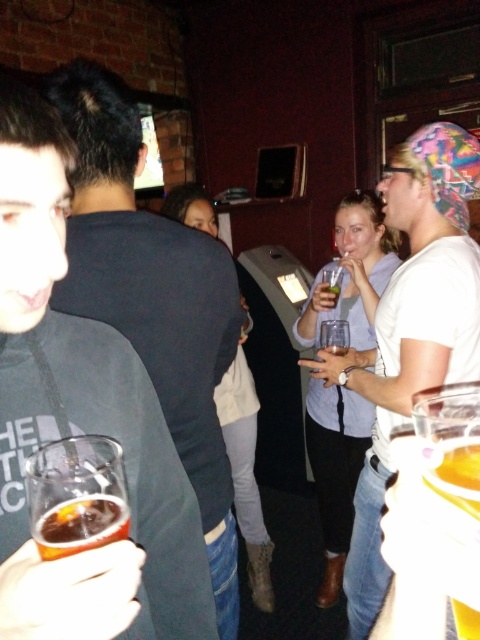
Question: Which of the following is the farthest from the observer?

Choices:
 (A) (435, 166)
 (B) (315, 323)
 (C) (272, 608)
 (D) (37, 538)

Answer: (C)

Question: Is clear plastic glass at left to the right of matte blue shirt at center from the viewer's perspective?

Choices:
 (A) no
 (B) yes

Answer: (A)

Question: Is clear plastic glass at left in front of matte blue shirt at center?

Choices:
 (A) yes
 (B) no

Answer: (A)

Question: Among these points, which one is nearest to the camera?

Choices:
 (A) (165, 211)
 (B) (434, 148)

Answer: (B)

Question: Among these objects, which one is farthest from the camera?

Choices:
 (A) clear plastic glass at left
 (B) white cotton t-shirt at upper right

Answer: (B)

Question: Is clear plastic glass at left wider than light blue denim jeans at center?

Choices:
 (A) yes
 (B) no

Answer: (A)